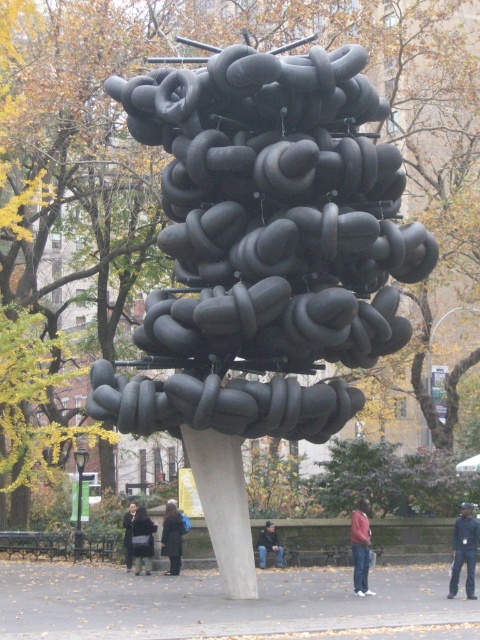
Question: Does dark blue jeans at lower right have a smaller size compared to dark gray jeans at center?

Choices:
 (A) no
 (B) yes

Answer: (A)

Question: Estimate the real-world distances between objects in this image. Which object is closer to the matte black sculpture at center?

Choices:
 (A) dark gray coat at center
 (B) black fabric coat at center
 (C) dark gray fabric jacket at center

Answer: (B)

Question: Can you confirm if matte black sculpture at center is positioned below dark gray wool coat at lower center?

Choices:
 (A) yes
 (B) no

Answer: (B)

Question: Which of the following is the closest to the observer?

Choices:
 (A) dark blue jeans at lower right
 (B) matte black sculpture at center

Answer: (B)

Question: Which of the following is the closest to the observer?

Choices:
 (A) dark gray jeans at center
 (B) matte black sculpture at center

Answer: (B)

Question: Is dark gray fabric jacket at center thinner than dark gray coat at center?

Choices:
 (A) yes
 (B) no

Answer: (B)